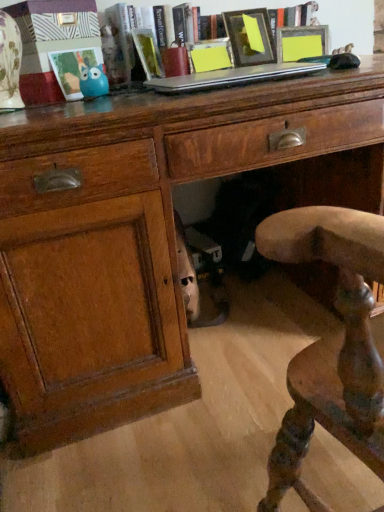
Locate an element on the screen. The height and width of the screenshot is (512, 384). matte black picture frame at upper center, acting as the first picture frame starting from the right is located at coordinates (249, 38).

What do you see at coordinates (249, 38) in the screenshot?
I see `matte black picture frame at upper center, which appears as the third picture frame when viewed from the left` at bounding box center [249, 38].

Locate an element on the screen. The image size is (384, 512). blue rubber toy at upper left is located at coordinates (93, 81).

What do you see at coordinates (93, 81) in the screenshot?
I see `blue rubber toy at upper left` at bounding box center [93, 81].

Where is `matte black picture frame at upper center, acting as the first picture frame starting from the right`? matte black picture frame at upper center, acting as the first picture frame starting from the right is located at coordinates 249,38.

In terms of size, does matte yellow picture frame at center, the second picture frame in the right-to-left sequence, appear bigger or smaller than blue rubber toy at upper left?

Considering their sizes, matte yellow picture frame at center, the second picture frame in the right-to-left sequence, takes up more space than blue rubber toy at upper left.

From a real-world perspective, relative to blue rubber toy at upper left, is matte yellow picture frame at center, which is the second picture frame from left to right, vertically above or below?

matte yellow picture frame at center, which is the second picture frame from left to right, is situated higher than blue rubber toy at upper left in the real world.

Is point (210, 65) positioned behind point (99, 90)?

Yes, point (210, 65) is farther from viewer.

What's the angular difference between matte yellow picture frame at center, the second picture frame in the right-to-left sequence, and blue rubber toy at upper left's facing directions?

The angular difference between matte yellow picture frame at center, the second picture frame in the right-to-left sequence, and blue rubber toy at upper left is 5.79 degrees.

The height and width of the screenshot is (512, 384). Find the location of `the 1st book to the left of the matte black picture frame at upper center, which appears as the third picture frame when viewed from the left, starting your count from the anchor`. the 1st book to the left of the matte black picture frame at upper center, which appears as the third picture frame when viewed from the left, starting your count from the anchor is located at coordinates (230, 76).

How far apart are matte black picture frame at upper center, acting as the first picture frame starting from the right, and hardcover book at upper center, positioned as the first book in right-to-left order?

The distance of matte black picture frame at upper center, acting as the first picture frame starting from the right, from hardcover book at upper center, positioned as the first book in right-to-left order, is 20.47 centimeters.

Consider the image. From a real-world perspective, does matte black picture frame at upper center, which appears as the third picture frame when viewed from the left, stand above hardcover book at upper center, positioned as the first book in right-to-left order?

No, from a real-world perspective, matte black picture frame at upper center, which appears as the third picture frame when viewed from the left, is not above hardcover book at upper center, positioned as the first book in right-to-left order.

Is matte black picture frame at upper center, which appears as the third picture frame when viewed from the left, wider or thinner than hardcover book at upper center, the 2th book in the left-to-right sequence?

matte black picture frame at upper center, which appears as the third picture frame when viewed from the left, is thinner than hardcover book at upper center, the 2th book in the left-to-right sequence.

Which is more to the left, matte black picture frame at upper center, which appears as the third picture frame when viewed from the left, or blue rubber toy at upper left?

From the viewer's perspective, blue rubber toy at upper left appears more on the left side.

From a real-world perspective, who is located higher, matte black picture frame at upper center, acting as the first picture frame starting from the right, or blue rubber toy at upper left?

matte black picture frame at upper center, acting as the first picture frame starting from the right.

Considering the sizes of matte black picture frame at upper center, acting as the first picture frame starting from the right, and blue rubber toy at upper left in the image, is matte black picture frame at upper center, acting as the first picture frame starting from the right, taller or shorter than blue rubber toy at upper left?

matte black picture frame at upper center, acting as the first picture frame starting from the right, is taller than blue rubber toy at upper left.

Considering the relative sizes of matte plastic picture frame at upper left, placed as the first picture frame when sorted from left to right, and silver metallic laptop at upper center in the image provided, is matte plastic picture frame at upper left, placed as the first picture frame when sorted from left to right, wider than silver metallic laptop at upper center?

No.

Would you say matte plastic picture frame at upper left, placed as the first picture frame when sorted from left to right, is inside or outside silver metallic laptop at upper center?

matte plastic picture frame at upper left, placed as the first picture frame when sorted from left to right, is outside silver metallic laptop at upper center.

The width and height of the screenshot is (384, 512). In order to click on laptop that is on the right side of matte plastic picture frame at upper left, the 3th picture frame from the right in this screenshot , I will do `click(231, 77)`.

Is silver metallic laptop at upper center at the back of matte plastic picture frame at upper left, placed as the first picture frame when sorted from left to right?

No, matte plastic picture frame at upper left, placed as the first picture frame when sorted from left to right,'s orientation is not away from silver metallic laptop at upper center.

Does silver metallic laptop at upper center have a lesser width compared to blue rubber toy at upper left?

Incorrect, the width of silver metallic laptop at upper center is not less than that of blue rubber toy at upper left.

Can you confirm if silver metallic laptop at upper center is positioned to the right of blue rubber toy at upper left?

Correct, you'll find silver metallic laptop at upper center to the right of blue rubber toy at upper left.

Between silver metallic laptop at upper center and blue rubber toy at upper left, which one has less height?

silver metallic laptop at upper center is shorter.

Is point (211, 47) in front of point (66, 52)?

No, it is behind (66, 52).

Consider the image. Could you measure the distance between matte yellow picture frame at center, the second picture frame in the right-to-left sequence, and matte plastic picture frame at upper left, the 3th picture frame from the right?

matte yellow picture frame at center, the second picture frame in the right-to-left sequence, and matte plastic picture frame at upper left, the 3th picture frame from the right, are 15.49 inches apart from each other.

Considering the sizes of objects matte yellow picture frame at center, the second picture frame in the right-to-left sequence, and matte plastic picture frame at upper left, the 3th picture frame from the right, in the image provided, who is smaller, matte yellow picture frame at center, the second picture frame in the right-to-left sequence, or matte plastic picture frame at upper left, the 3th picture frame from the right,?

Smaller between the two is matte yellow picture frame at center, the second picture frame in the right-to-left sequence.

Between matte yellow picture frame at center, the second picture frame in the right-to-left sequence, and matte plastic picture frame at upper left, the 3th picture frame from the right, which one has smaller width?

Thinner between the two is matte plastic picture frame at upper left, the 3th picture frame from the right.

Does silver metallic laptop at upper center have a greater width compared to matte yellow picture frame at center, which is the second picture frame from left to right?

Indeed, silver metallic laptop at upper center has a greater width compared to matte yellow picture frame at center, which is the second picture frame from left to right.

Is matte yellow picture frame at center, which is the second picture frame from left to right, inside silver metallic laptop at upper center?

No.

Measure the distance from silver metallic laptop at upper center to matte yellow picture frame at center, the second picture frame in the right-to-left sequence.

A distance of 8.66 inches exists between silver metallic laptop at upper center and matte yellow picture frame at center, the second picture frame in the right-to-left sequence.

Considering the sizes of silver metallic laptop at upper center and matte yellow picture frame at center, the second picture frame in the right-to-left sequence, in the image, is silver metallic laptop at upper center taller or shorter than matte yellow picture frame at center, the second picture frame in the right-to-left sequence,?

Clearly, silver metallic laptop at upper center is shorter compared to matte yellow picture frame at center, the second picture frame in the right-to-left sequence.

You are a GUI agent. You are given a task and a screenshot of the screen. Output one action in this format:
    pyautogui.click(x=<x>, y=<y>)
    Task: Click on the picture frame that is the 2nd object located above the blue rubber toy at upper left (from the image's perspective)
    This screenshot has height=512, width=384.
    Given the screenshot: What is the action you would take?
    pyautogui.click(x=210, y=55)

I want to click on picture frame on the right side of hardcover book at upper center, positioned as the first book in right-to-left order, so click(249, 38).

Estimate the real-world distances between objects in this image. Which object is closer to hardcover book at center, positioned as the 2th book in right-to-left order, silver metallic laptop at upper center or matte yellow picture frame at center, which is the second picture frame from left to right?

The object closer to hardcover book at center, positioned as the 2th book in right-to-left order, is matte yellow picture frame at center, which is the second picture frame from left to right.

Looking at the image, which one is located further to hardcover book at upper center, positioned as the first book in right-to-left order, silver metallic laptop at upper center or blue rubber toy at upper left?

blue rubber toy at upper left lies further to hardcover book at upper center, positioned as the first book in right-to-left order, than the other object.

Estimate the real-world distances between objects in this image. Which object is closer to matte yellow picture frame at center, which is the second picture frame from left to right, hardcover book at upper center, positioned as the first book in right-to-left order, or matte black picture frame at upper center, which appears as the third picture frame when viewed from the left?

matte black picture frame at upper center, which appears as the third picture frame when viewed from the left, is positioned closer to the anchor matte yellow picture frame at center, which is the second picture frame from left to right.

From the picture: Looking at the image, which one is located further to hardcover book at upper center, positioned as the first book in right-to-left order, matte plastic picture frame at upper left, placed as the first picture frame when sorted from left to right, or matte black picture frame at upper center, acting as the first picture frame starting from the right?

matte plastic picture frame at upper left, placed as the first picture frame when sorted from left to right.

Looking at the image, which one is located closer to matte black picture frame at upper center, which appears as the third picture frame when viewed from the left, matte plastic picture frame at upper left, placed as the first picture frame when sorted from left to right, or silver metallic laptop at upper center?

silver metallic laptop at upper center lies closer to matte black picture frame at upper center, which appears as the third picture frame when viewed from the left, than the other object.

Based on their spatial positions, is silver metallic laptop at upper center or matte black picture frame at upper center, acting as the first picture frame starting from the right, closer to hardcover book at center, acting as the first book starting from the left?

Based on the image, silver metallic laptop at upper center appears to be nearer to hardcover book at center, acting as the first book starting from the left.

Based on their spatial positions, is matte plastic picture frame at upper left, placed as the first picture frame when sorted from left to right, or blue rubber toy at upper left closer to matte black picture frame at upper center, which appears as the third picture frame when viewed from the left?

blue rubber toy at upper left is closer to matte black picture frame at upper center, which appears as the third picture frame when viewed from the left.

Looking at the image, which one is located closer to silver metallic laptop at upper center, hardcover book at center, acting as the first book starting from the left, or blue rubber toy at upper left?

hardcover book at center, acting as the first book starting from the left, is closer to silver metallic laptop at upper center.

Where is `picture frame between blue rubber toy at upper left and hardcover book at upper center, positioned as the first book in right-to-left order, from left to right`? The image size is (384, 512). picture frame between blue rubber toy at upper left and hardcover book at upper center, positioned as the first book in right-to-left order, from left to right is located at coordinates (210, 55).

Find the location of a particular element. The image size is (384, 512). toy between matte plastic picture frame at upper left, placed as the first picture frame when sorted from left to right, and matte black picture frame at upper center, which appears as the third picture frame when viewed from the left is located at coordinates (93, 81).

Where is `picture frame between matte plastic picture frame at upper left, the 3th picture frame from the right, and matte black picture frame at upper center, which appears as the third picture frame when viewed from the left`? The image size is (384, 512). picture frame between matte plastic picture frame at upper left, the 3th picture frame from the right, and matte black picture frame at upper center, which appears as the third picture frame when viewed from the left is located at coordinates (210, 55).

Locate an element on the screen. The height and width of the screenshot is (512, 384). book between hardcover book at center, acting as the first book starting from the left, and matte black picture frame at upper center, which appears as the third picture frame when viewed from the left is located at coordinates (230, 76).